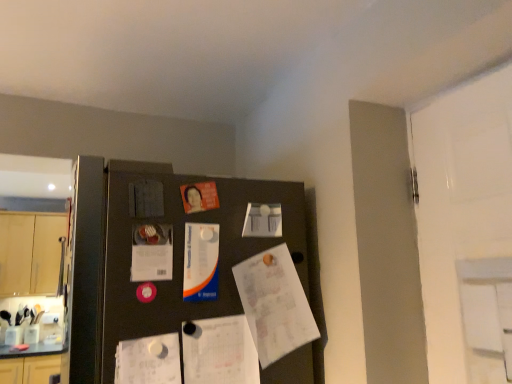
Question: Which direction should I rotate to face orange matte poster at upper center, marked as the 1th poster in a top-to-bottom arrangement, — up or down?

Choices:
 (A) down
 (B) up

Answer: (A)

Question: Is white paper at lower left, the 2th poster from the bottom, bigger than blue glossy poster at center, which appears as the third poster when ordered from the bottom?

Choices:
 (A) yes
 (B) no

Answer: (A)

Question: Is white paper at lower left, the 6th poster when ordered from top to bottom, located outside blue glossy poster at center, the 5th poster viewed from the top?

Choices:
 (A) yes
 (B) no

Answer: (A)

Question: Considering the relative positions of white paper at lower left, the 6th poster when ordered from top to bottom, and blue glossy poster at center, which appears as the third poster when ordered from the bottom, in the image provided, is white paper at lower left, the 6th poster when ordered from top to bottom, to the right of blue glossy poster at center, which appears as the third poster when ordered from the bottom, from the viewer's perspective?

Choices:
 (A) yes
 (B) no

Answer: (B)

Question: Can you confirm if white paper at lower left, the 6th poster when ordered from top to bottom, is shorter than blue glossy poster at center, the 5th poster viewed from the top?

Choices:
 (A) yes
 (B) no

Answer: (B)

Question: Is white paper at lower left, the 2th poster from the bottom, taller than blue glossy poster at center, which appears as the third poster when ordered from the bottom?

Choices:
 (A) no
 (B) yes

Answer: (B)

Question: From a real-world perspective, is white paper at lower left, the 2th poster from the bottom, below blue glossy poster at center, the 5th poster viewed from the top?

Choices:
 (A) no
 (B) yes

Answer: (B)

Question: Does matte paper poster at center-left, which appears as the 4th poster when ordered from the bottom, appear on the right side of white paper at lower left, the 6th poster when ordered from top to bottom?

Choices:
 (A) yes
 (B) no

Answer: (B)

Question: Would you consider matte paper poster at center-left, the 4th poster positioned from the top, to be distant from white paper at lower left, the 2th poster from the bottom?

Choices:
 (A) yes
 (B) no

Answer: (B)

Question: Is matte paper poster at center-left, the 4th poster positioned from the top, in front of white paper at lower left, the 2th poster from the bottom?

Choices:
 (A) yes
 (B) no

Answer: (B)

Question: Does matte paper poster at center-left, the 4th poster positioned from the top, have a smaller size compared to white paper at lower left, the 2th poster from the bottom?

Choices:
 (A) no
 (B) yes

Answer: (B)

Question: Is matte paper poster at center-left, which appears as the 4th poster when ordered from the bottom, bigger than white paper at lower left, the 2th poster from the bottom?

Choices:
 (A) yes
 (B) no

Answer: (B)

Question: Considering the relative positions of matte paper poster at center-left, the 4th poster positioned from the top, and white paper at lower left, the 2th poster from the bottom, in the image provided, is matte paper poster at center-left, the 4th poster positioned from the top, behind white paper at lower left, the 2th poster from the bottom,?

Choices:
 (A) no
 (B) yes

Answer: (B)

Question: Is black matte fridge at center next to white glossy paper at upper center, which ranks as the 5th poster in bottom-to-top order?

Choices:
 (A) no
 (B) yes

Answer: (A)